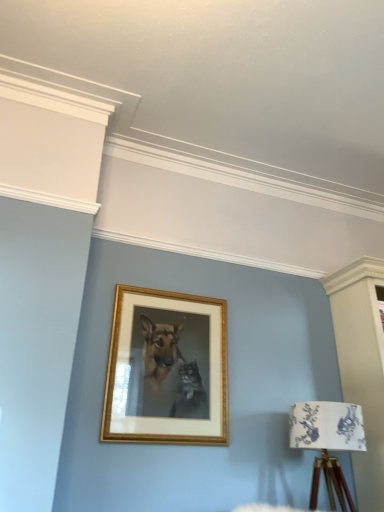
Question: Is gold wooden picture frame at center facing towards white floral fabric at lower right?

Choices:
 (A) yes
 (B) no

Answer: (B)

Question: From the image's perspective, is gold wooden picture frame at center below white floral fabric at lower right?

Choices:
 (A) no
 (B) yes

Answer: (A)

Question: Is gold wooden picture frame at center further to camera compared to white floral fabric at lower right?

Choices:
 (A) no
 (B) yes

Answer: (B)

Question: Can you confirm if gold wooden picture frame at center is positioned to the left of white floral fabric at lower right?

Choices:
 (A) no
 (B) yes

Answer: (B)

Question: Are gold wooden picture frame at center and white floral fabric at lower right located far from each other?

Choices:
 (A) no
 (B) yes

Answer: (A)

Question: From a real-world perspective, is gold wooden picture frame at center under white floral fabric at lower right?

Choices:
 (A) no
 (B) yes

Answer: (A)

Question: Is white floral fabric at lower right with gold wooden picture frame at center?

Choices:
 (A) yes
 (B) no

Answer: (B)

Question: Is white floral fabric at lower right thinner than gold wooden picture frame at center?

Choices:
 (A) no
 (B) yes

Answer: (A)

Question: Is white floral fabric at lower right facing away from gold wooden picture frame at center?

Choices:
 (A) yes
 (B) no

Answer: (B)

Question: Is white floral fabric at lower right positioned far away from gold wooden picture frame at center?

Choices:
 (A) yes
 (B) no

Answer: (B)

Question: Does white floral fabric at lower right have a larger size compared to gold wooden picture frame at center?

Choices:
 (A) yes
 (B) no

Answer: (A)

Question: Is white floral fabric at lower right further to the viewer compared to gold wooden picture frame at center?

Choices:
 (A) no
 (B) yes

Answer: (A)

Question: Is white floral fabric at lower right taller or shorter than gold wooden picture frame at center?

Choices:
 (A) short
 (B) tall

Answer: (A)